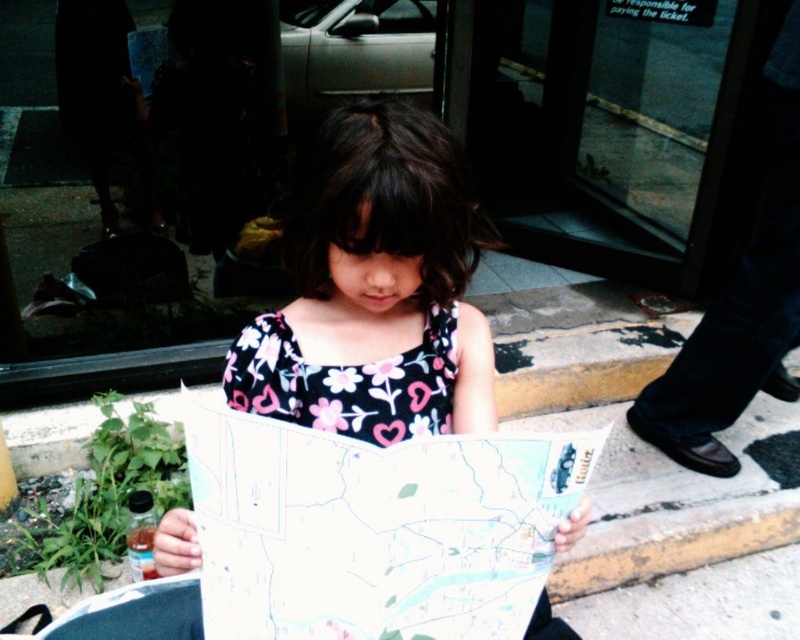
Is white paper map at center to the right of floral-patterned fabric dress at center from the viewer's perspective?

Correct, you'll find white paper map at center to the right of floral-patterned fabric dress at center.

Between white paper map at center and floral-patterned fabric dress at center, which one is positioned lower?

floral-patterned fabric dress at center is below.

Does point (462, 209) come behind point (264, 364)?

That is False.

Where is `white paper map at center`? This screenshot has width=800, height=640. white paper map at center is located at coordinates 374,288.